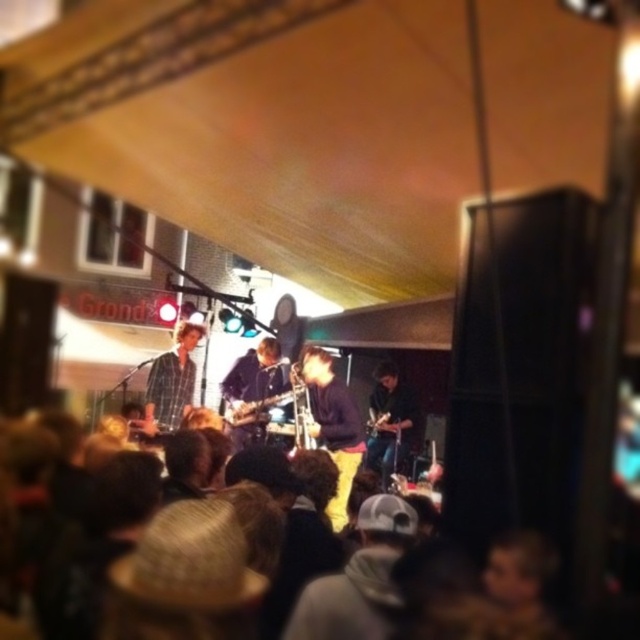
Is point (326, 438) behind point (246, 412)?

No, it is not.

The image size is (640, 640). What do you see at coordinates (333, 426) in the screenshot?
I see `matte yellow pants at center` at bounding box center [333, 426].

At what (x,y) coordinates should I click in order to perform the action: click on matte yellow pants at center. Please return your answer as a coordinate pair (x, y). Looking at the image, I should click on (333, 426).

What are the coordinates of `dark blue jeans at lower center` in the screenshot? It's located at (388, 422).

Which is behind, point (404, 400) or point (227, 419)?

The point (404, 400) is more distant.

Locate an element on the screen. Image resolution: width=640 pixels, height=640 pixels. dark blue jeans at lower center is located at coordinates (388, 422).

Can you confirm if matte yellow pants at center is positioned below dark blue jeans at lower center?

Incorrect, matte yellow pants at center is not positioned below dark blue jeans at lower center.

From the picture: Is matte yellow pants at center taller than dark blue jeans at lower center?

Yes, matte yellow pants at center is taller than dark blue jeans at lower center.

In order to click on matte yellow pants at center in this screenshot , I will do `click(333, 426)`.